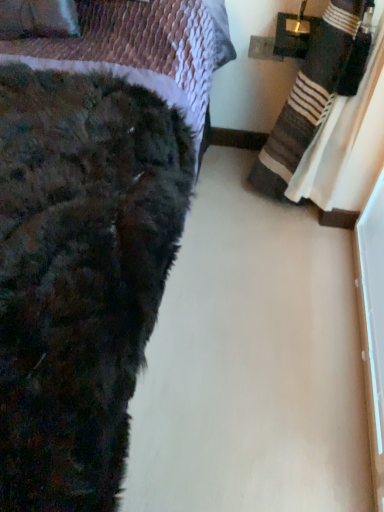
Question: Considering the relative sizes of striped cotton blanket at right and velvet purple throw pillow at upper left in the image provided, is striped cotton blanket at right smaller than velvet purple throw pillow at upper left?

Choices:
 (A) no
 (B) yes

Answer: (A)

Question: Is striped cotton blanket at right oriented towards velvet purple throw pillow at upper left?

Choices:
 (A) yes
 (B) no

Answer: (A)

Question: From the image's perspective, is striped cotton blanket at right over velvet purple throw pillow at upper left?

Choices:
 (A) no
 (B) yes

Answer: (A)

Question: Does striped cotton blanket at right have a lesser height compared to velvet purple throw pillow at upper left?

Choices:
 (A) yes
 (B) no

Answer: (B)

Question: Considering the relative sizes of striped cotton blanket at right and velvet purple throw pillow at upper left in the image provided, is striped cotton blanket at right wider than velvet purple throw pillow at upper left?

Choices:
 (A) no
 (B) yes

Answer: (B)

Question: Looking at their shapes, would you say fuzzy black blanket at lower left is wider or thinner than striped cotton blanket at right?

Choices:
 (A) thin
 (B) wide

Answer: (B)

Question: From a real-world perspective, is fuzzy black blanket at lower left above or below striped cotton blanket at right?

Choices:
 (A) above
 (B) below

Answer: (A)

Question: From the image's perspective, is fuzzy black blanket at lower left positioned above or below striped cotton blanket at right?

Choices:
 (A) above
 (B) below

Answer: (B)

Question: Considering the relative positions of fuzzy black blanket at lower left and striped cotton blanket at right in the image provided, is fuzzy black blanket at lower left to the left or to the right of striped cotton blanket at right?

Choices:
 (A) left
 (B) right

Answer: (A)

Question: Is point (347, 39) closer or farther from the camera than point (9, 97)?

Choices:
 (A) farther
 (B) closer

Answer: (A)

Question: From a real-world perspective, relative to fuzzy black blanket at lower left, is striped cotton blanket at right vertically above or below?

Choices:
 (A) below
 (B) above

Answer: (A)

Question: In the image, is striped cotton blanket at right on the left side or the right side of fuzzy black blanket at lower left?

Choices:
 (A) right
 (B) left

Answer: (A)

Question: From the image's perspective, is striped cotton blanket at right positioned above or below fuzzy black blanket at lower left?

Choices:
 (A) below
 (B) above

Answer: (B)

Question: From a real-world perspective, relative to velvet purple throw pillow at upper left, is striped cotton blanket at right vertically above or below?

Choices:
 (A) above
 (B) below

Answer: (B)

Question: Relative to velvet purple throw pillow at upper left, is striped cotton blanket at right in front or behind?

Choices:
 (A) front
 (B) behind

Answer: (A)